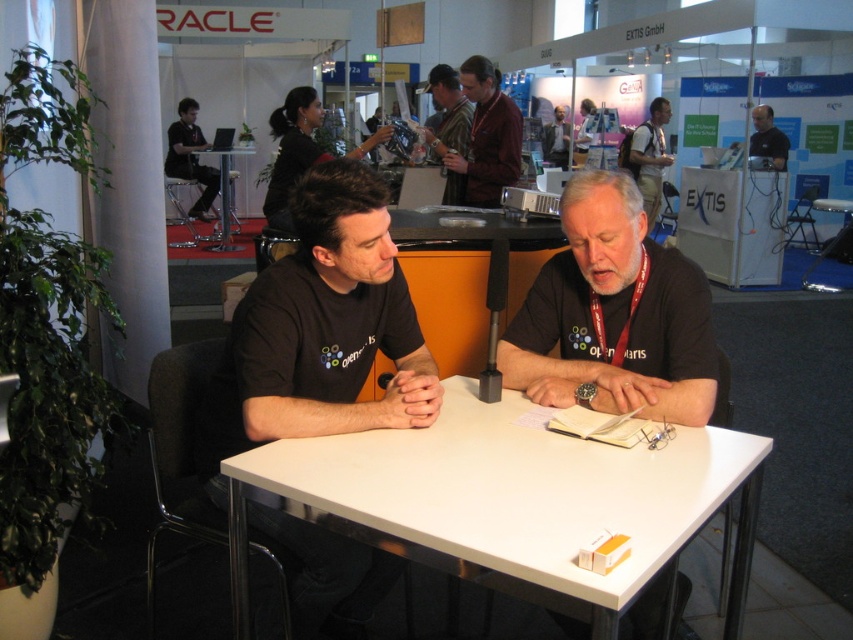
You are an event organizer at the trade show and need to arrange a photo shoot. You want to place the striped shirt at center and the matte black shirt at upper center side by side. Which shirt should be placed on the left side to make them look balanced?

The striped shirt at center is thinner than the matte black shirt at upper center. To balance them, place the thicker matte black shirt at upper center on the left and the thinner striped shirt at center on the right.

In the scene shown: You are at a trade show and want to approach the two people wearing striped shirt at center and matte black shirt at upper center. Which one should you approach first if you want to speak to the person closer to the table?

The striped shirt at center is positioned under matte black shirt at upper center, meaning the striped shirt at center is closer to the table. You should approach the striped shirt at center first.

You are standing at the entrance of the exhibition hall. You see a white glossy table at center and a point marked at coordinates (508, 500). Can you determine if the point is located on the white glossy table at center?

The point marked at coordinates (508, 500) is located on the white glossy table at center.